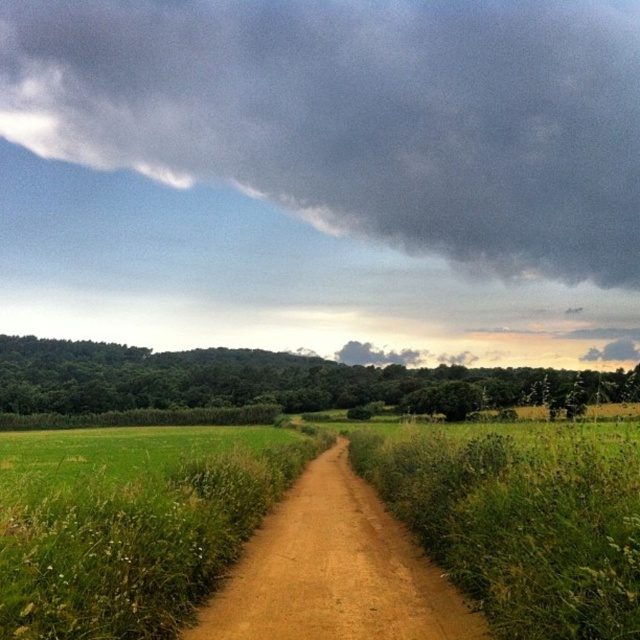
You are standing on the dirt path and want to take a photo of the dark gray cloud at upper center. Which direction should you face to capture it in the frame?

The dark gray cloud at upper center is located at point 0.180 on the x axis and 0.561 on the y axis, so you should face towards the upper center direction to capture it in the frame.